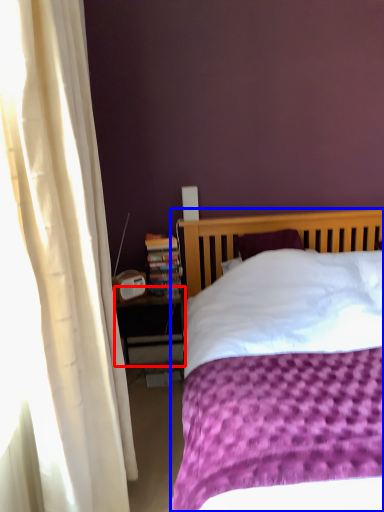
Question: Among these objects, which one is farthest to the camera, nightstand (highlighted by a red box) or bed (highlighted by a blue box)?

Choices:
 (A) nightstand
 (B) bed

Answer: (A)